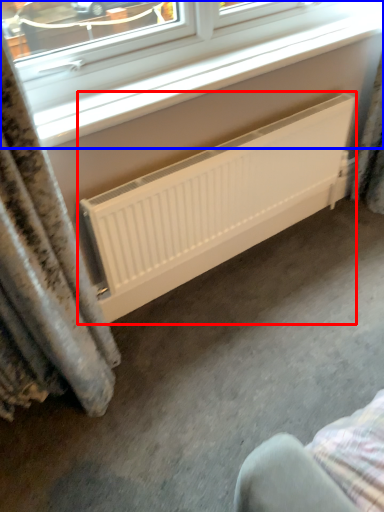
Question: Which object appears farthest to the camera in this image, radiator (highlighted by a red box) or window (highlighted by a blue box)?

Choices:
 (A) radiator
 (B) window

Answer: (A)